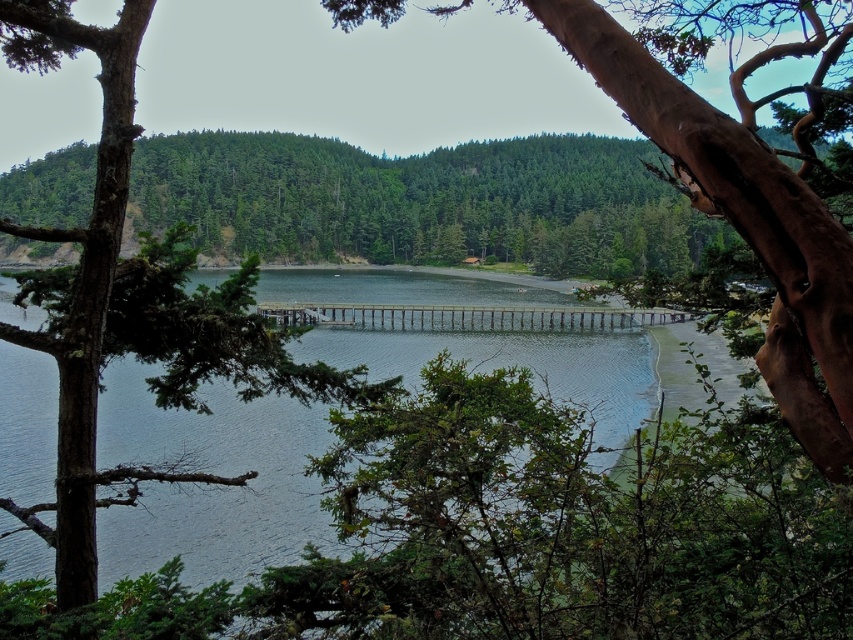
You are an environmental scientist assessing the health of the ecosystem. You observe the clear water at center and the brown rough tree trunk at center. Which of these two objects occupies a greater area in the scene?

The clear water at center has a larger size compared to the brown rough tree trunk at center, so it occupies a greater area in the scene.

You are a kayaker planning to paddle through the clear water at center and the brown rough tree trunk at center. Which object will you encounter first as you move forward?

The brown rough tree trunk at center will be encountered first because it is shorter than the clear water at center, meaning it is closer to the kayaker.